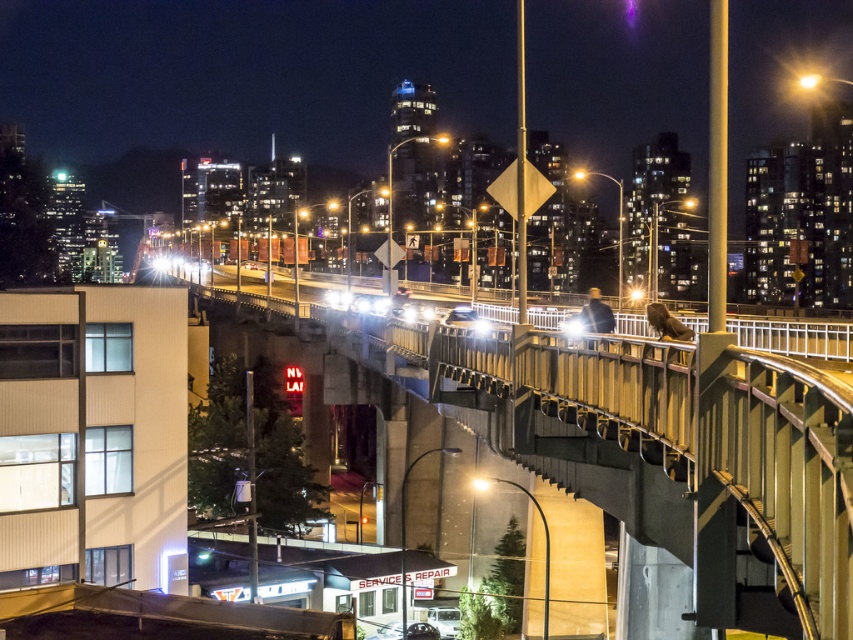
Does point (646, 340) come in front of point (676, 310)?

Yes, point (646, 340) is closer to viewer.

Who is positioned more to the right, concrete bridge at center or metallic gray bridge at center?

concrete bridge at center

I want to click on concrete bridge at center, so click(x=674, y=452).

At what (x,y) coordinates should I click in order to perform the action: click on concrete bridge at center. Please return your answer as a coordinate pair (x, y). Looking at the image, I should click on (674, 452).